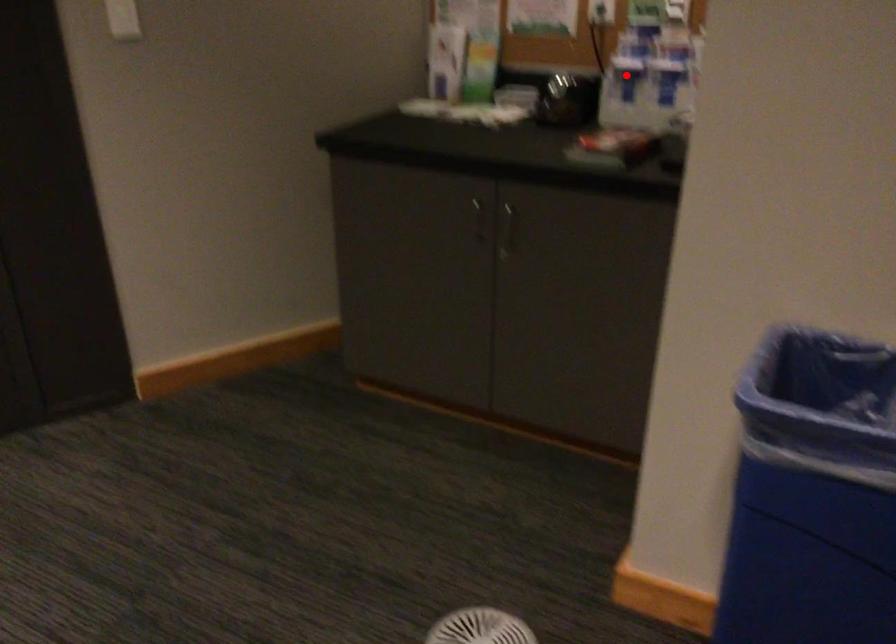
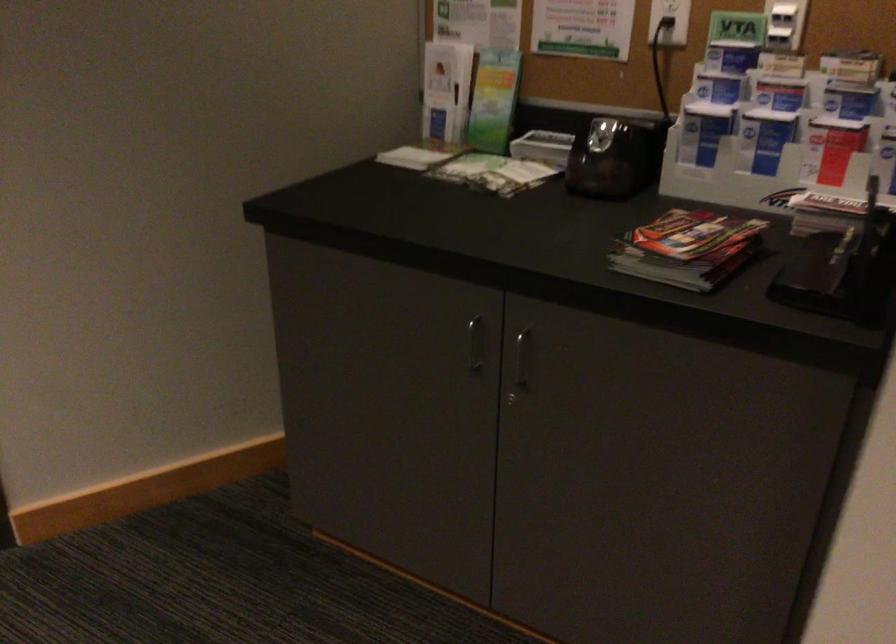
Question: I am providing you with two images of the same scene from different viewpoints. Image1 has a red point marked. In image2, the corresponding 3D location appears at what relative position? Reply with the corresponding letter.

Choices:
 (A) Closer
 (B) Farther

Answer: (A)